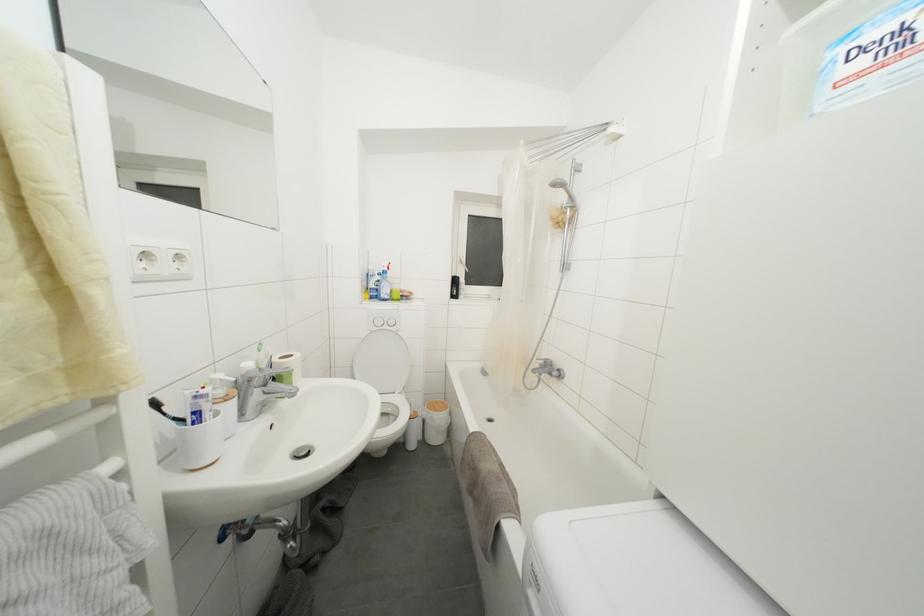
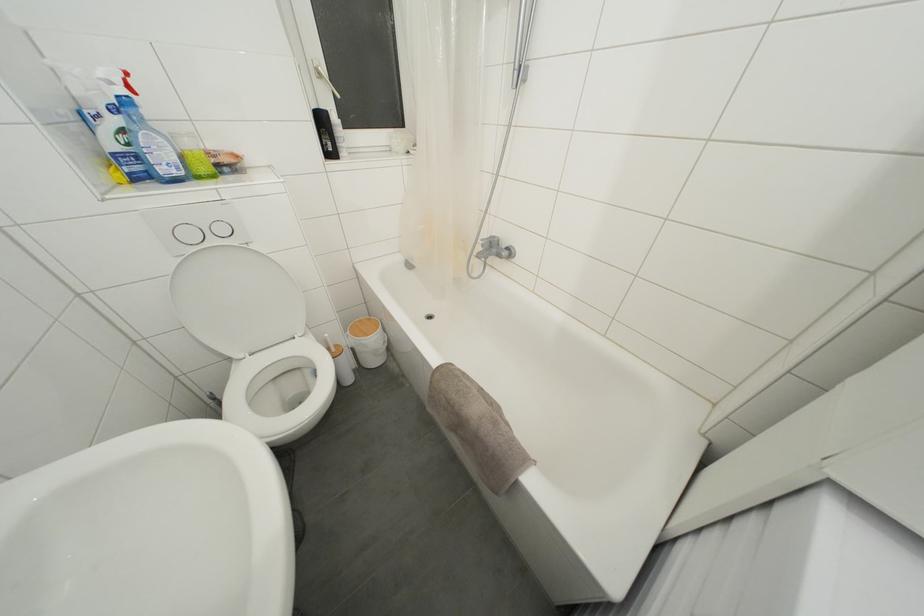
In the second image, find the point that corresponds to [395,328] in the first image.

(226, 235)